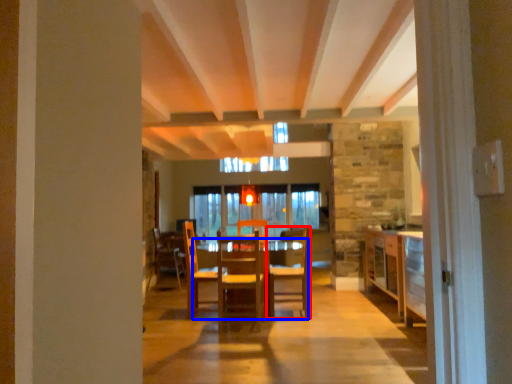
Question: Which point is further to the camera, chair (highlighted by a red box) or table (highlighted by a blue box)?

Choices:
 (A) chair
 (B) table

Answer: (A)